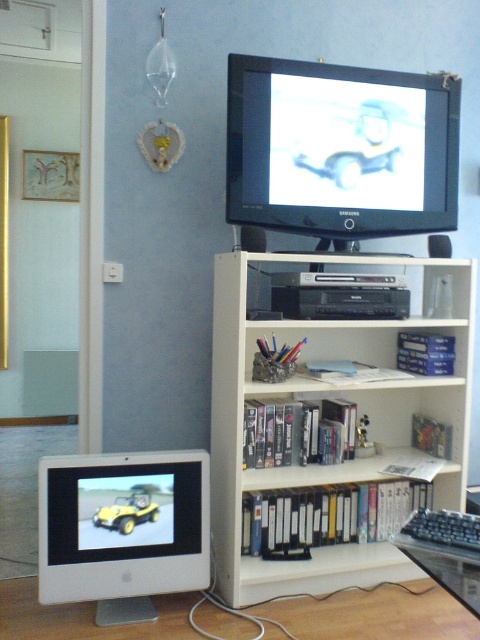
Question: Which object appears farthest from the camera in this image?

Choices:
 (A) yellow matte toy car at center
 (B) white wood bookshelf at center

Answer: (A)

Question: Does white wood bookshelf at center have a greater width compared to white glossy computer monitor at lower left?

Choices:
 (A) yes
 (B) no

Answer: (A)

Question: Which object is the farthest from the yellow matte toy car at center?

Choices:
 (A) white wood bookshelf at center
 (B) white glossy computer monitor at lower left

Answer: (A)

Question: Which of the following is the closest to the observer?

Choices:
 (A) matte black monitor at upper center
 (B) white glossy computer monitor at lower left

Answer: (B)

Question: Does white wood bookshelf at center have a smaller size compared to white glossy computer monitor at lower left?

Choices:
 (A) no
 (B) yes

Answer: (A)

Question: Does white wood bookshelf at center have a larger size compared to yellow matte toy car at center?

Choices:
 (A) yes
 (B) no

Answer: (A)